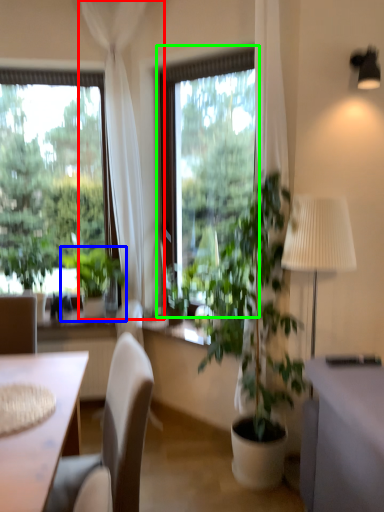
Question: Which object is positioned closest to curtain (highlighted by a red box)? Select from houseplant (highlighted by a blue box) and window (highlighted by a green box).

Choices:
 (A) houseplant
 (B) window

Answer: (B)